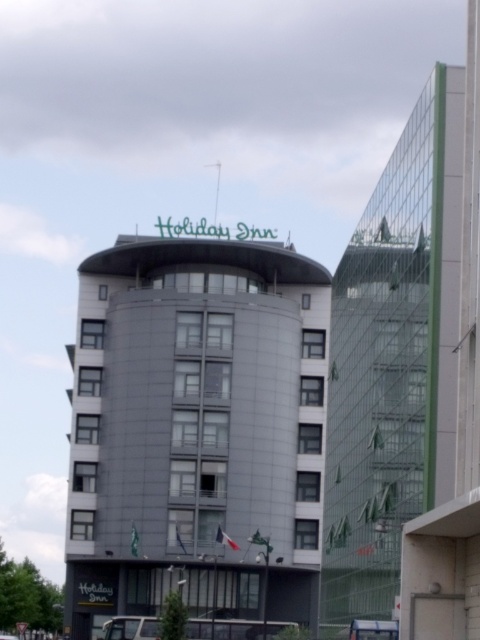
You are standing in front of the two buildings described. If you want to take a photo of the gray concrete building at center and the green glass building at right, which building should you position yourself to the left of to capture both in the frame?

You should position yourself to the left of the green glass building at right to include both the gray concrete building at center and the green glass building at right in your photo, since the gray concrete building at center is to the left of the green glass building at right.

You are a city planner reviewing the urban layout. Considering the scale of the gray concrete building at center and the green glass building at right, which one would require more space for construction?

The gray concrete building at center has a larger size compared to the green glass building at right, so it would require more space for construction.

You are a city planner assessing the urban layout. Given the two buildings in the scene, which one has a greater width when comparing the gray concrete building at center and the green glass building at right?

The gray concrete building at center has a greater width than the green glass building at right according to the description provided.